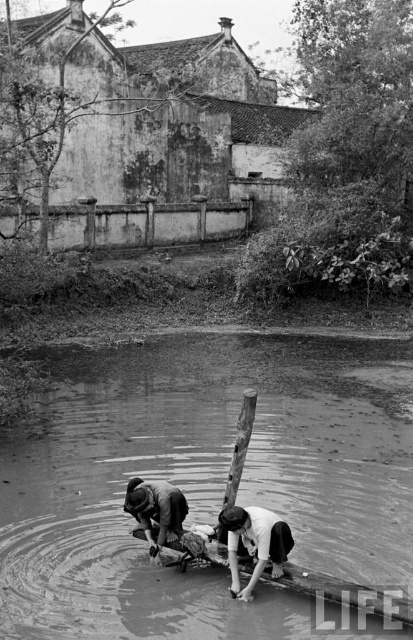
You are a photographer trying to capture the reflection of the smooth white shirt at lower center in the smooth water at center. Based on the scene description, do you think the reflection will be fully visible in the water?

The smooth water at center has a larger size compared to smooth white shirt at lower center, so the reflection of the smooth white shirt at lower center should be fully visible within the smooth water at center.

You are standing at the edge of the water and want to reach the smooth white shirt at lower center. Which direction should you move to get closer to it?

The smooth white shirt at lower center is located at point 0.850 on the x and 0.613 on the y, so you should move towards the lower center direction to reach it.

You are a photographer analyzing this black and white photo. You notice the smooth white shirt at lower center and the dark gray fabric at lower center. Which of these two items appears bigger in the photo?

The smooth white shirt at lower center is larger in size than the dark gray fabric at lower center, so it appears bigger in the photo.